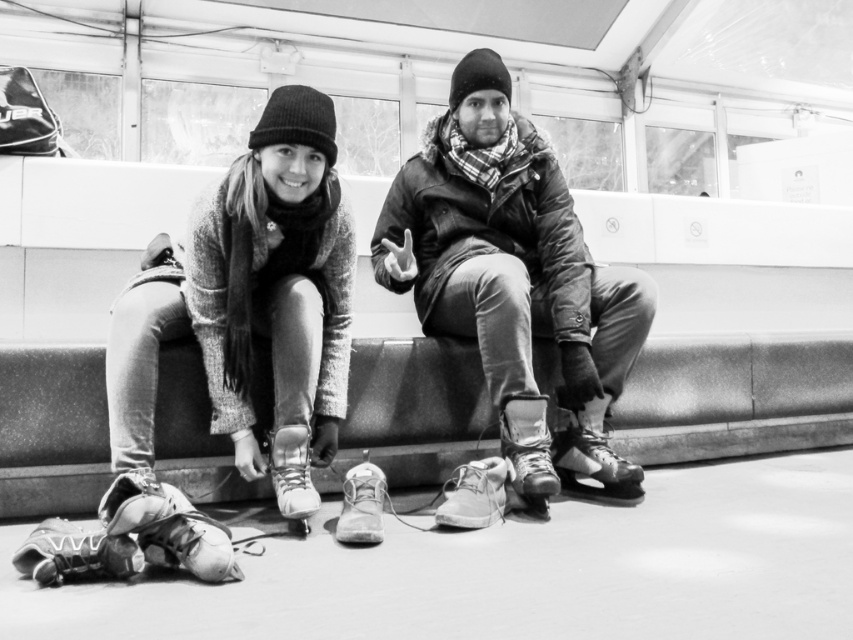
Question: Among these points, which one is farthest from the camera?

Choices:
 (A) (370, 522)
 (B) (314, 502)

Answer: (B)

Question: Is matte black boot at lower center above leather shoe at lower center?

Choices:
 (A) no
 (B) yes

Answer: (B)

Question: Is knit woolen beanie at upper left smaller than leather boot at lower center?

Choices:
 (A) no
 (B) yes

Answer: (A)

Question: Among these objects, which one is farthest from the camera?

Choices:
 (A) leather boot at lower center
 (B) leather shoe at lower center
 (C) shiny leather boot at lower center

Answer: (C)

Question: Which is farther from the shiny leather boot at lower center?

Choices:
 (A) leather shoe at lower center
 (B) leather shoe at center
 (C) knit woolen beanie at upper left
 (D) leather skate at lower left

Answer: (D)

Question: Can you confirm if leather boot at lower center is positioned below shiny leather boot at lower center?

Choices:
 (A) no
 (B) yes

Answer: (A)